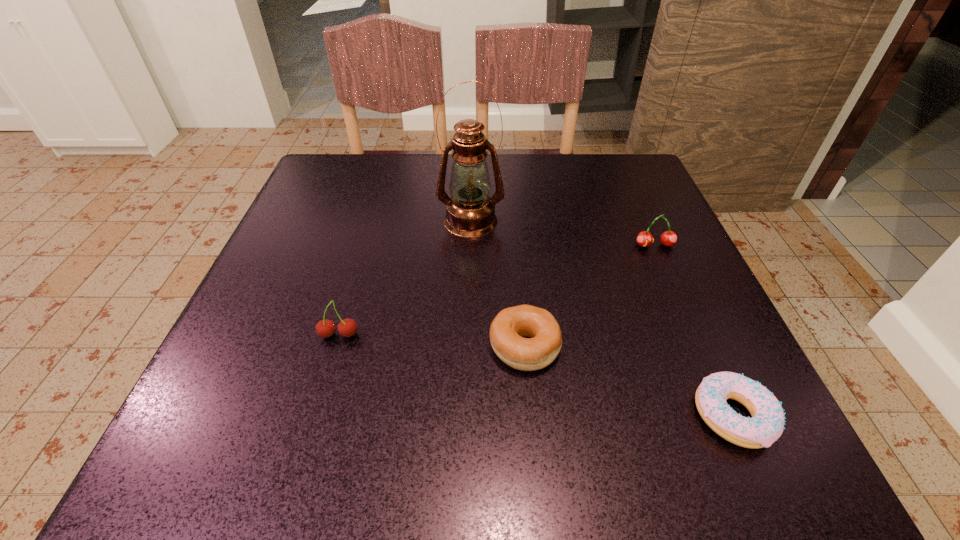
Locate an element on the screen. The width and height of the screenshot is (960, 540). free space at the left edge of the desktop is located at coordinates (256, 337).

Find the location of a particular element. This screenshot has height=540, width=960. free location at the right edge is located at coordinates (619, 280).

Locate an element on the screen. The image size is (960, 540). vacant space at the far left corner of the desktop is located at coordinates (323, 180).

The image size is (960, 540). In the image, there is a desktop. In order to click on free space at the near right corner in this screenshot , I will do `click(668, 444)`.

Identify the location of unoccupied position between the right cherry and the oil lamp. The image size is (960, 540). (563, 233).

Locate an element on the screen. vacant space that is in between the left cherry and the doughnut is located at coordinates (536, 375).

The width and height of the screenshot is (960, 540). I want to click on vacant region between the bagel and the farthest object, so click(497, 283).

Where is `empty space that is in between the right cherry and the oil lamp`? empty space that is in between the right cherry and the oil lamp is located at coordinates [563, 233].

Find the location of `unoccupied position between the oil lamp and the farther cherry`. unoccupied position between the oil lamp and the farther cherry is located at coordinates (563, 233).

The height and width of the screenshot is (540, 960). I want to click on blank region between the leftmost object and the bagel, so click(432, 340).